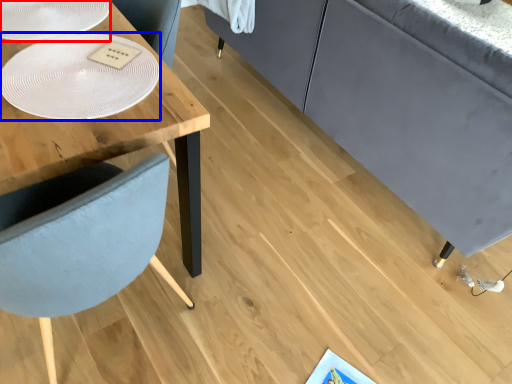
Question: Which of the following is the closest to the observer, glass plate (highlighted by a red box) or glass plate (highlighted by a blue box)?

Choices:
 (A) glass plate
 (B) glass plate

Answer: (B)